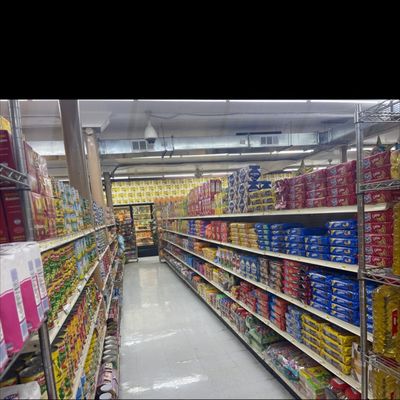
At what (x,y) coordinates should I click in order to perform the action: click on cooking oil. Please return your answer as a coordinate pair (x, y). Looking at the image, I should click on (385, 321), (385, 382), (395, 242), (395, 167).